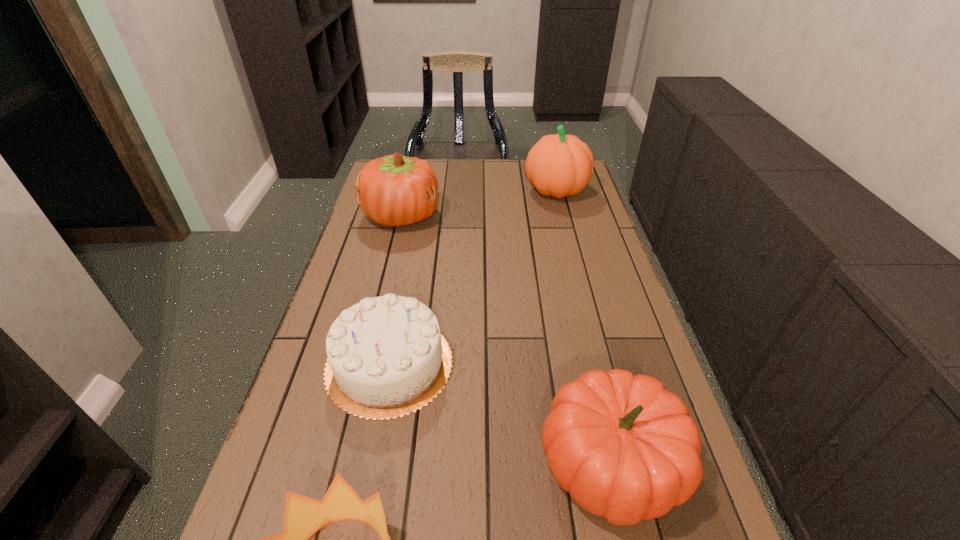
You are a GUI agent. You are given a task and a screenshot of the screen. Output one action in this format:
    pyautogui.click(x=<x>, y=<y>)
    Task: Click on the leftmost pumpkin
    The height and width of the screenshot is (540, 960).
    Given the screenshot: What is the action you would take?
    pyautogui.click(x=395, y=190)

Identify the location of the shortest pumpkin. This screenshot has height=540, width=960. click(625, 448).

Locate an element on the screen. This screenshot has width=960, height=540. birthday cake is located at coordinates (387, 358).

Identify the location of vacant point located on the side of the leftmost pumpkin with the cute face. This screenshot has width=960, height=540. (520, 215).

Locate an element on the screen. vacant area situated on the back of the nearest pumpkin is located at coordinates (571, 292).

Where is `vacant space located 0.290m on the right of the birthday cake`? vacant space located 0.290m on the right of the birthday cake is located at coordinates (580, 363).

Locate an element on the screen. This screenshot has width=960, height=540. object that is positioned at the far edge is located at coordinates (559, 165).

Where is `pumpkin that is at the left edge`? The image size is (960, 540). pumpkin that is at the left edge is located at coordinates [395, 190].

I want to click on birthday cake that is at the left edge, so click(387, 358).

At what (x,y) coordinates should I click in order to perform the action: click on object present at the far right corner. Please return your answer as a coordinate pair (x, y). This screenshot has width=960, height=540. Looking at the image, I should click on (559, 165).